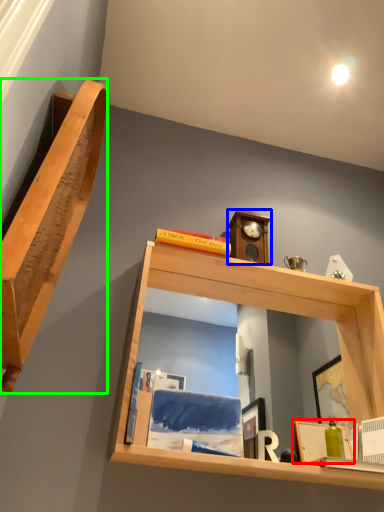
Question: Based on their relative distances, which object is farther from picture frame (highlighted by a red box)? Choose from clock (highlighted by a blue box) and shelf (highlighted by a green box).

Choices:
 (A) clock
 (B) shelf

Answer: (B)